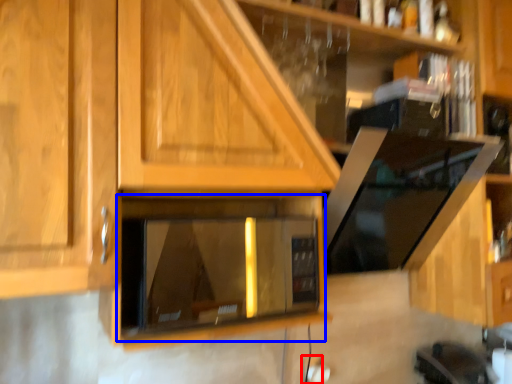
Question: Which point is closer to the camera, electric outlet (highlighted by a red box) or appliance (highlighted by a blue box)?

Choices:
 (A) electric outlet
 (B) appliance

Answer: (B)